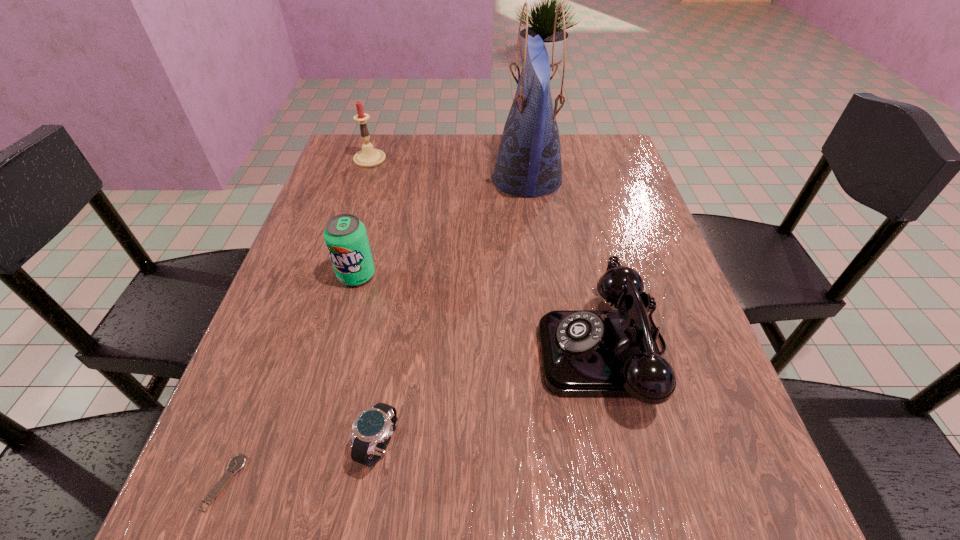
This screenshot has width=960, height=540. What are the coordinates of `the tallest object` in the screenshot? It's located at (528, 163).

Find the location of a particular element. Image resolution: width=960 pixels, height=540 pixels. the fifth shortest object is located at coordinates (368, 157).

Identify the location of pop soda. (345, 235).

Where is `telephone`? telephone is located at coordinates pyautogui.click(x=584, y=353).

Find the location of `the fourth object from left to right`. the fourth object from left to right is located at coordinates (373, 428).

At what (x,y) coordinates should I click in order to perform the action: click on the fifth tallest object. Please return your answer as a coordinate pair (x, y). This screenshot has width=960, height=540. Looking at the image, I should click on (373, 428).

At what (x,y) coordinates should I click in order to perform the action: click on the shorter watch. Please return your answer as a coordinate pair (x, y). This screenshot has height=540, width=960. Looking at the image, I should click on (238, 462).

Identify the location of the shortest object. (238, 462).

The width and height of the screenshot is (960, 540). I want to click on vacant position located 0.160m on the right of the tallest object, so click(623, 179).

You are a GUI agent. You are given a task and a screenshot of the screen. Output one action in this format:
    pyautogui.click(x=<x>, y=<y>)
    Task: Click on the vacant space located 0.120m on the right of the candle
    
    Given the screenshot: What is the action you would take?
    pyautogui.click(x=428, y=159)